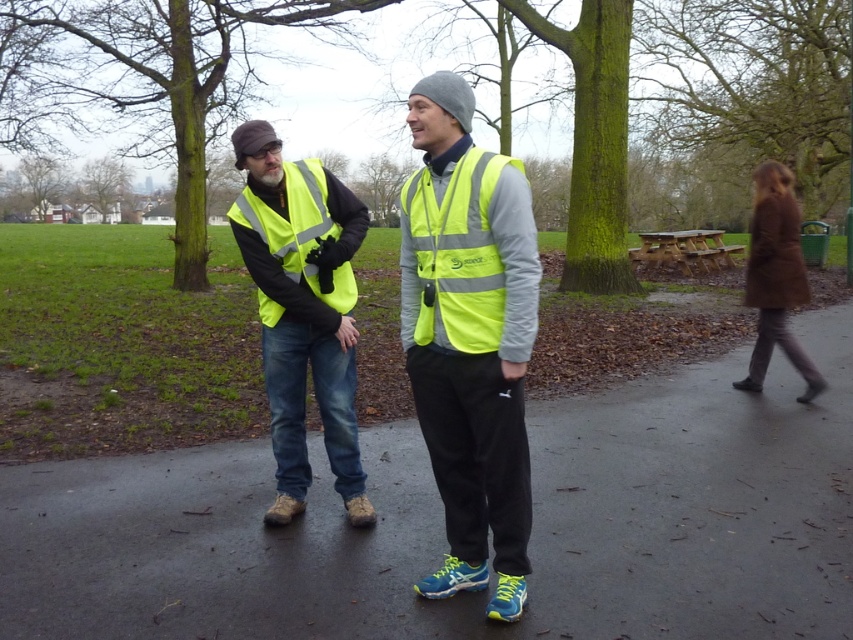
Consider the image. You are standing at the point with coordinates point (790, 230) and want to walk towards the person on the left. Is the point point (256, 260) in your way?

Yes, the point (256, 260) is in front of point (790, 230), so it is in your way when walking towards the person on the left.